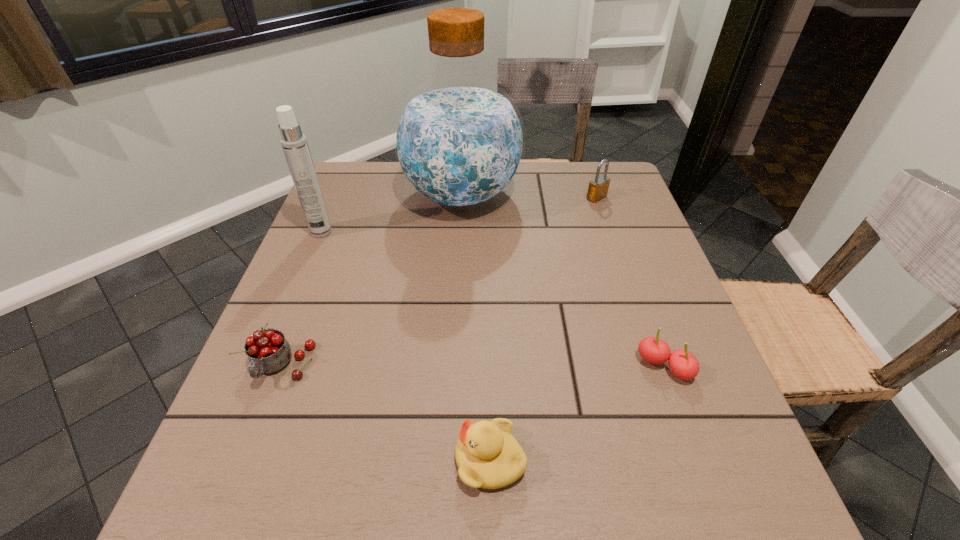
Identify the location of water jug. This screenshot has width=960, height=540. (459, 139).

This screenshot has width=960, height=540. I want to click on aerosol can, so click(x=294, y=143).

Identify the location of padlock. (598, 187).

Locate an element on the screen. the left cherry is located at coordinates (268, 351).

This screenshot has height=540, width=960. I want to click on the nearest object, so click(x=488, y=456).

Locate an element on the screen. The width and height of the screenshot is (960, 540). the shorter cherry is located at coordinates (683, 364).

Image resolution: width=960 pixels, height=540 pixels. In order to click on vacant space positioned 0.130m on the front of the water jug in this screenshot , I will do [x=458, y=269].

Where is `vacant space located on the back of the aerosol can`? vacant space located on the back of the aerosol can is located at coordinates point(350,162).

Locate an element on the screen. The width and height of the screenshot is (960, 540). free spot located on the front of the padlock is located at coordinates [606, 224].

Identify the location of vacant space situated on the handle side of the taller cherry. (241, 472).